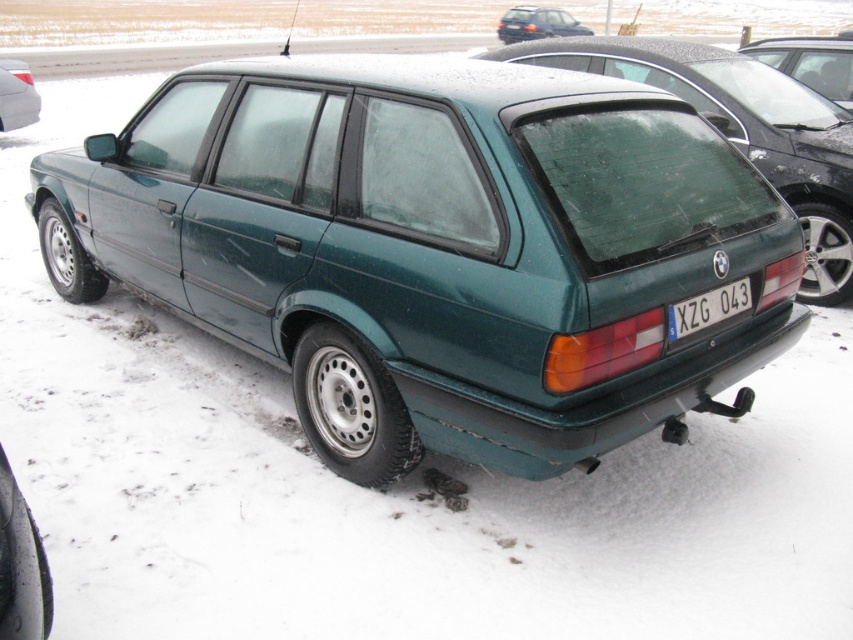
You are standing in front of the vintage BMW E30 Touring station wagon parked in the snowy environment. You see two points marked on the car. The first point is at coordinate point (x=680, y=314) and the second is at point (x=503, y=13). If you were to walk around the car from the front to the back, which point would you encounter first?

Point (x=680, y=314) is in front of point (x=503, y=13), so you would encounter point (x=680, y=314) first when walking from the front to the back of the vintage BMW E30 Touring station wagon.

You are standing in front of the vintage BMW E30 Touring station wagon parked in the snowy environment. You notice two points on the car labeled as point (791, 61) and point (517, 10). Which of these points is closer to you?

Point (791, 61) is closer to the viewer than point (517, 10).

You are a delivery person trying to deliver a package to the address on the blue metallic license plate at center. You need to know if the license plate is above or below the metallic green wagon at upper center. Can you tell me?

The blue metallic license plate at center is positioned under the metallic green wagon at upper center, so it is below the wagon.